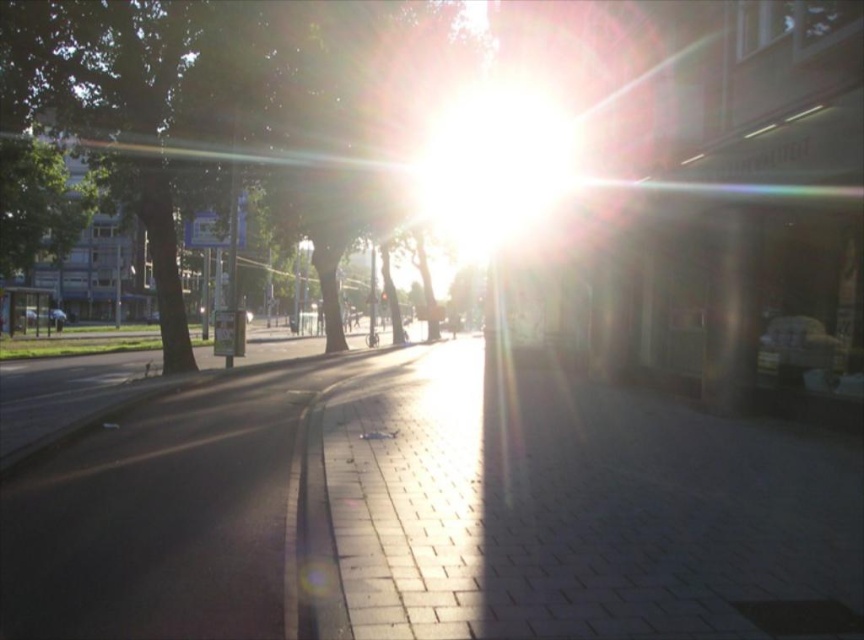
Who is more forward, (x=745, y=602) or (x=75, y=51)?

Positioned in front is point (x=745, y=602).

Can you confirm if brick pavement at center is positioned to the right of green leafy tree at center?

Correct, you'll find brick pavement at center to the right of green leafy tree at center.

Find the location of a particular element. The height and width of the screenshot is (640, 864). brick pavement at center is located at coordinates (433, 509).